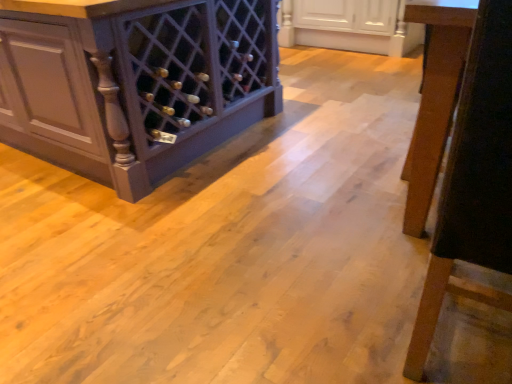
Locate an element on the screen. This screenshot has width=512, height=384. free space underneath wooden chair leg at right (from a real-world perspective) is located at coordinates (464, 334).